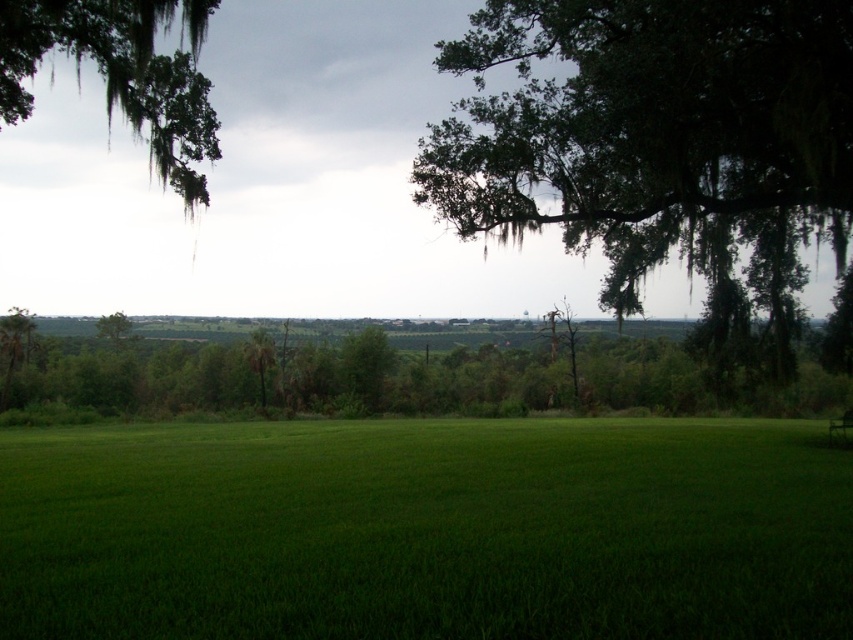
Question: Based on their relative distances, which object is farther from the green mossy branch at upper left?

Choices:
 (A) green leafy tree at upper right
 (B) green leafy tree at center

Answer: (B)

Question: Where is green mossy branch at upper left located in relation to green leafy tree at center in the image?

Choices:
 (A) right
 (B) left

Answer: (A)

Question: Considering the real-world distances, which object is closest to the green grass at center?

Choices:
 (A) green leafy tree at upper right
 (B) green leafy tree at center

Answer: (A)

Question: Can you confirm if green leafy tree at upper right is positioned to the left of green mossy branch at upper left?

Choices:
 (A) no
 (B) yes

Answer: (A)

Question: Which of the following is the farthest from the observer?

Choices:
 (A) (120, 310)
 (B) (547, 86)
 (C) (194, 36)

Answer: (A)

Question: Does green grass at center have a greater width compared to green leafy tree at center?

Choices:
 (A) yes
 (B) no

Answer: (A)